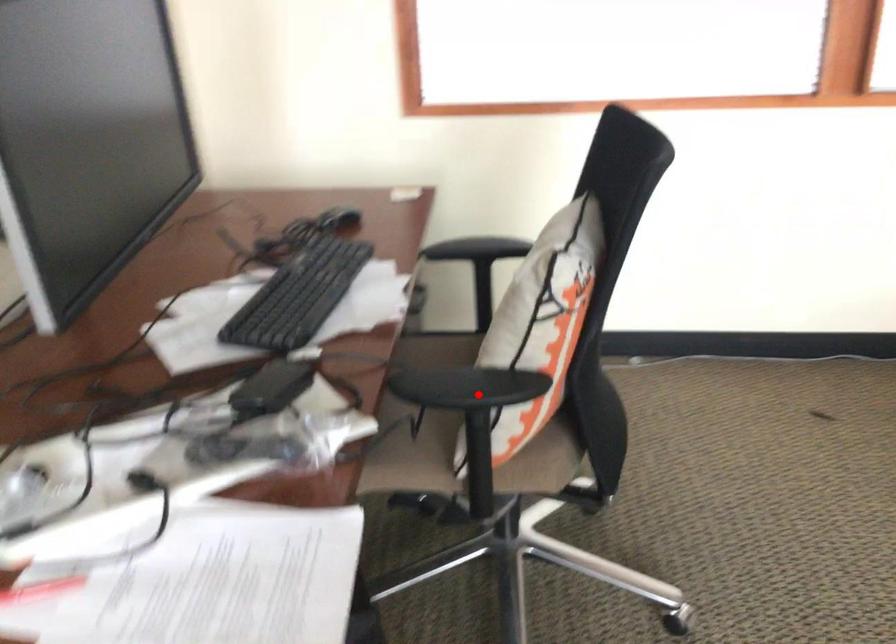
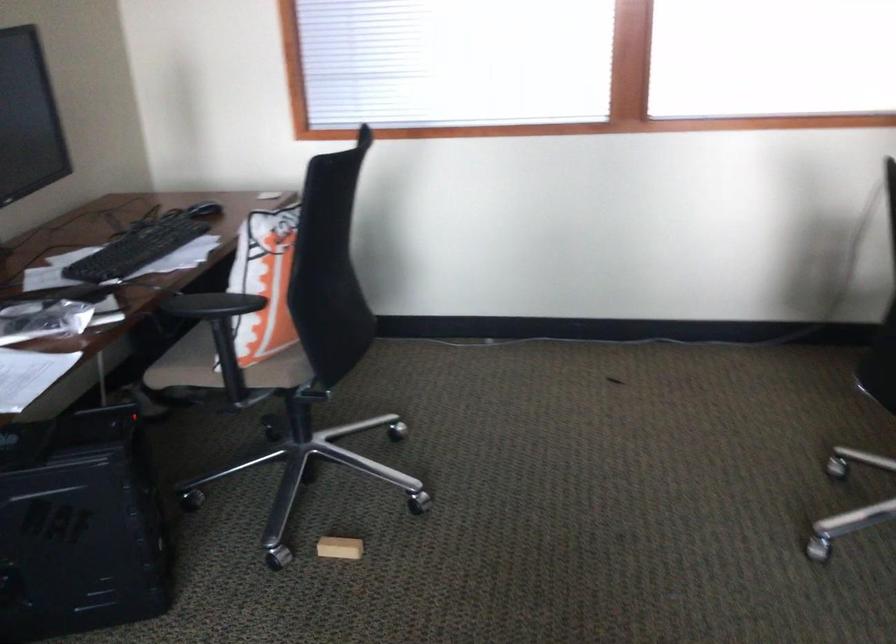
The point at the highlighted location is marked in the first image. Where is the corresponding point in the second image?

(211, 305)